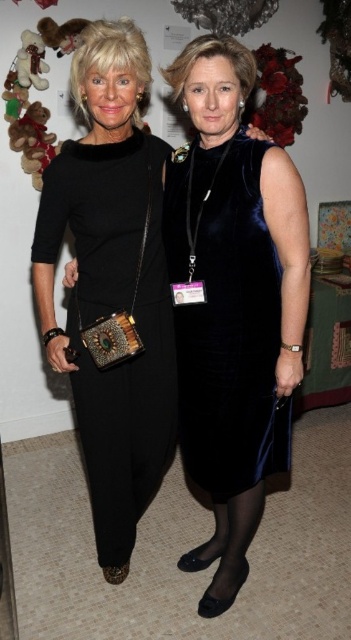
Is black velvet dress at left bigger than velvet dark blue dress at center?

Correct, black velvet dress at left is larger in size than velvet dark blue dress at center.

Is black velvet dress at left smaller than velvet dark blue dress at center?

No.

Does point (142, 294) come closer to viewer compared to point (228, 420)?

No, it is not.

This screenshot has height=640, width=351. In order to click on black velvet dress at left in this screenshot , I will do `click(109, 314)`.